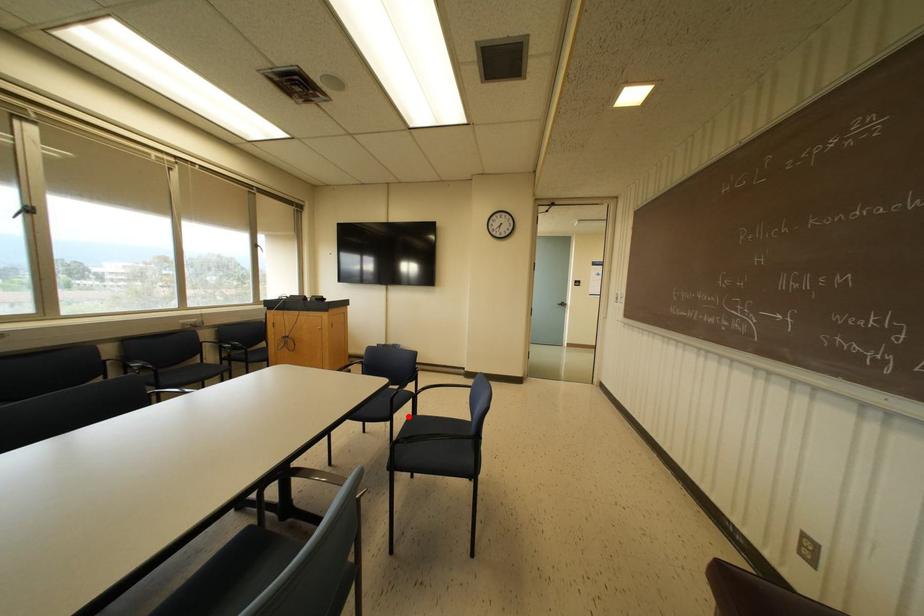
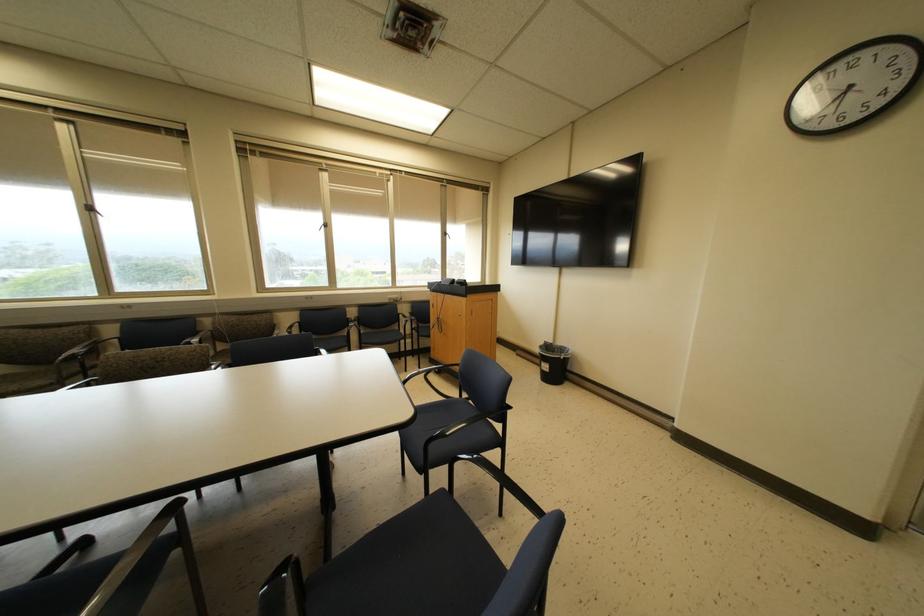
Question: I am providing you with two images of the same scene from different viewpoints. In image1, a red point is highlighted. Considering the same 3D point in image2, which of the following is correct?

Choices:
 (A) It is closer
 (B) It is farther

Answer: (B)